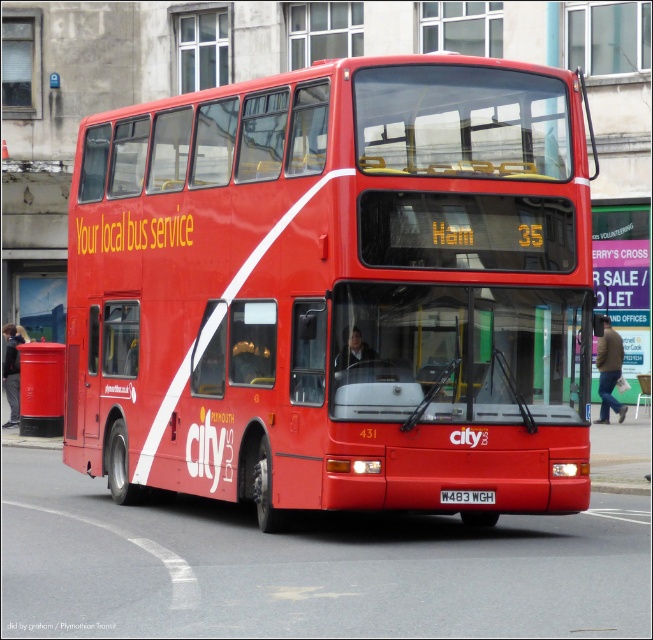
You are a pedestrian standing in front of the red double decker bus. You see the metallic red postbox at lower left and the white plastic license plate at center. Which object is closer to you?

The metallic red postbox at lower left is closer to you because it is further to the viewer than the white plastic license plate at center.

You are a delivery person who needs to place a sticker on the metallic red postbox at lower left and the white plastic license plate at center. Which object requires a larger sticker in terms of height?

The metallic red postbox at lower left requires a larger sticker in terms of height because it is much taller than the white plastic license plate at center.

You are a delivery person trying to decide whether to place a large package on the matte red bus at center or the metallic red postbox at lower left. Which object is shorter in height so that the package won

The matte red bus at center is not as tall as the metallic red postbox at lower left, so the package should be placed on the matte red bus at center since it is shorter in height.